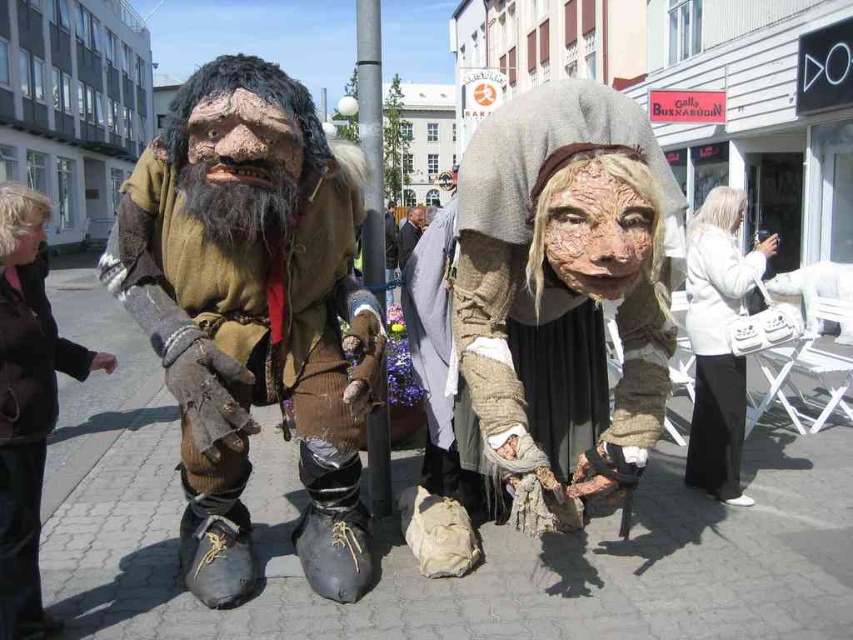
Is white leather handbag at lower right to the left of matte gray suit at center from the viewer's perspective?

No, white leather handbag at lower right is not to the left of matte gray suit at center.

Does white leather handbag at lower right have a greater height compared to matte gray suit at center?

In fact, white leather handbag at lower right may be shorter than matte gray suit at center.

Image resolution: width=853 pixels, height=640 pixels. Find the location of `white leather handbag at lower right`. white leather handbag at lower right is located at coordinates coord(717,356).

You are a GUI agent. You are given a task and a screenshot of the screen. Output one action in this format:
    pyautogui.click(x=<x>, y=<y>)
    Task: Click on the white leather handbag at lower right
    Image resolution: width=853 pixels, height=640 pixels.
    Given the screenshot: What is the action you would take?
    pyautogui.click(x=717, y=356)

Does matte gray fabric at center appear on the left side of matte brown leather boots at lower left?

Incorrect, matte gray fabric at center is not on the left side of matte brown leather boots at lower left.

This screenshot has width=853, height=640. What do you see at coordinates (561, 289) in the screenshot? I see `matte gray fabric at center` at bounding box center [561, 289].

Image resolution: width=853 pixels, height=640 pixels. What are the coordinates of `matte gray fabric at center` in the screenshot? It's located at (561, 289).

Is matte brown fur coat at left positioned behind black metal pole at center?

No.

Which is more to the right, matte brown fur coat at left or black metal pole at center?

matte brown fur coat at left is more to the right.

Identify the location of matte brown fur coat at left. The height and width of the screenshot is (640, 853). (252, 316).